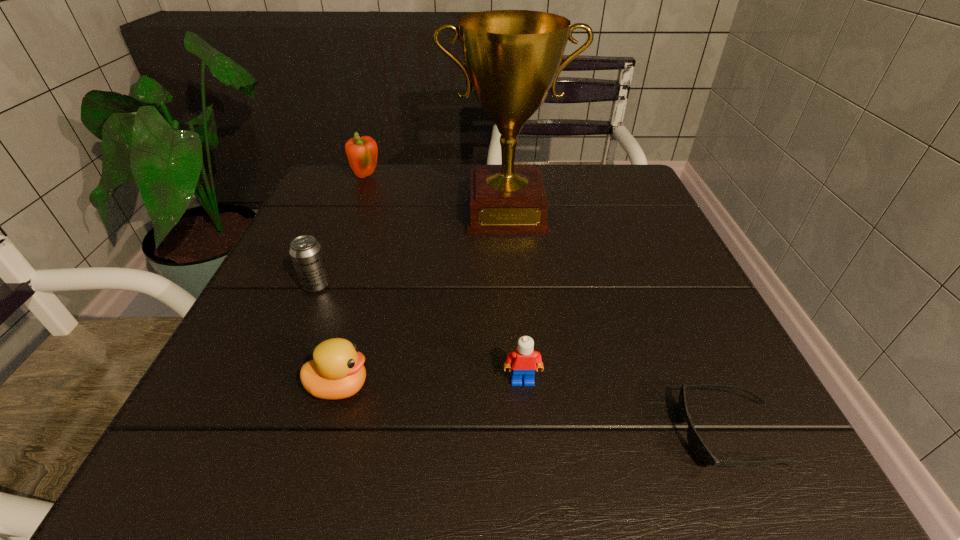
Identify the location of the fifth nearest object. The image size is (960, 540). (512, 57).

The height and width of the screenshot is (540, 960). What are the coordinates of `award` in the screenshot? It's located at (512, 57).

Locate an element on the screen. the fifth shortest object is located at coordinates (362, 152).

The image size is (960, 540). Find the location of `the farthest object`. the farthest object is located at coordinates (362, 152).

Where is `beer can`? The height and width of the screenshot is (540, 960). beer can is located at coordinates (306, 253).

This screenshot has width=960, height=540. I want to click on Lego, so click(524, 359).

Where is `duckling`? duckling is located at coordinates (336, 372).

This screenshot has height=540, width=960. In order to click on sunglasses in this screenshot , I will do `click(701, 452)`.

Locate an element on the screen. This screenshot has height=540, width=960. the rightmost object is located at coordinates (701, 452).

The height and width of the screenshot is (540, 960). I want to click on free space located 0.330m on the plaque of the award, so click(517, 360).